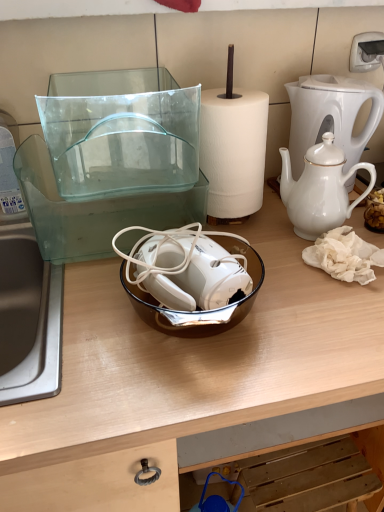
At what (x,y) coordinates should I click in order to perform the action: click on vacant region to the right of brown glass bowl at center. Please return your answer as a coordinate pair (x, y). The width and height of the screenshot is (384, 512). Looking at the image, I should click on (309, 312).